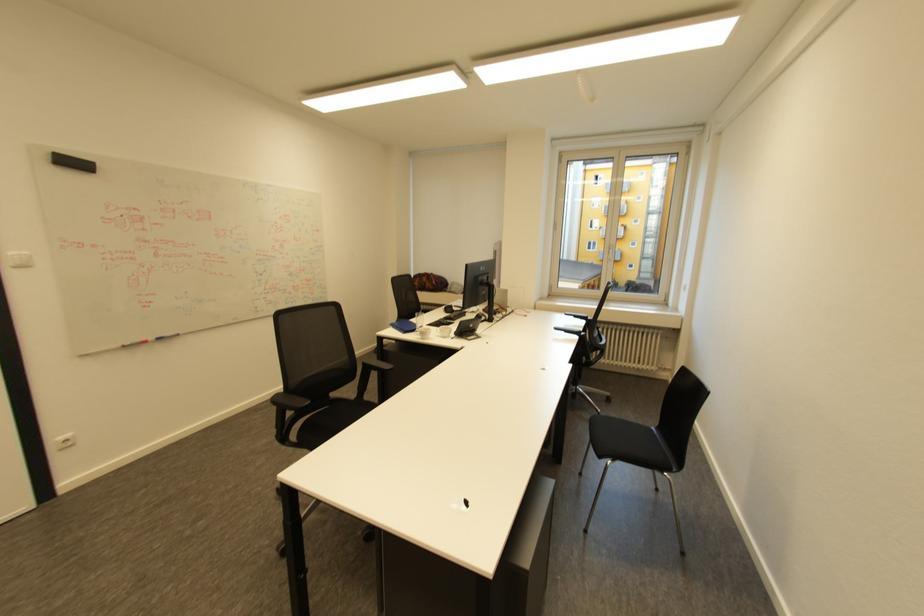
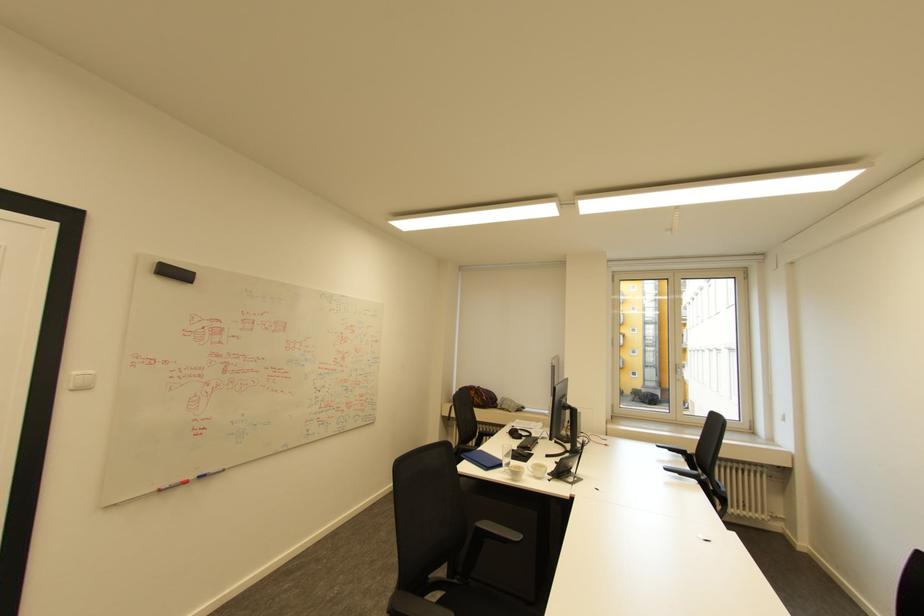
Where in the second image is the point corresponding to [446,334] from the first image?

(539, 474)